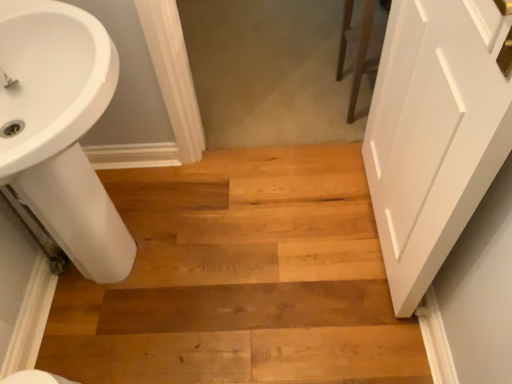
Identify the location of vacant space underneath white glossy sink at lower left (from a real-world perspective). click(126, 279).